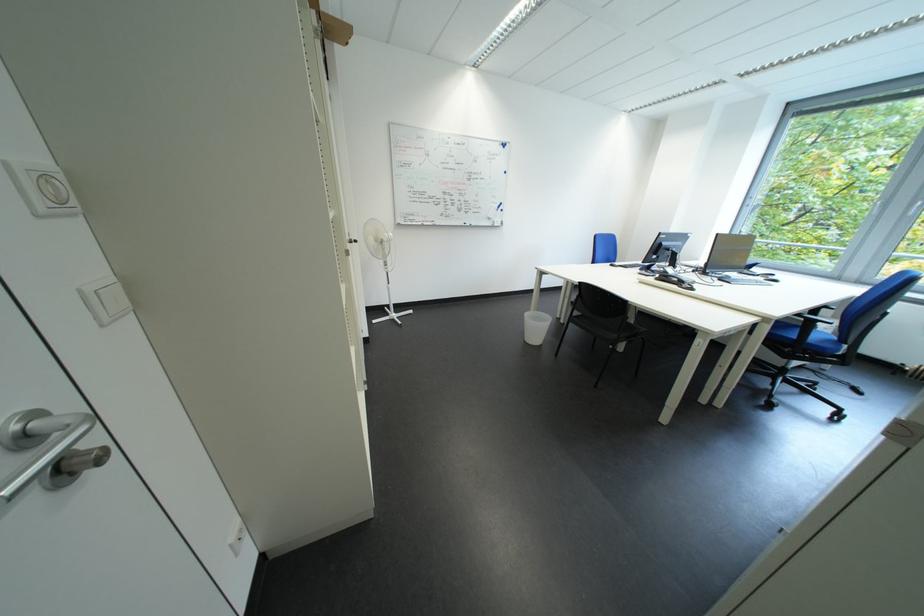
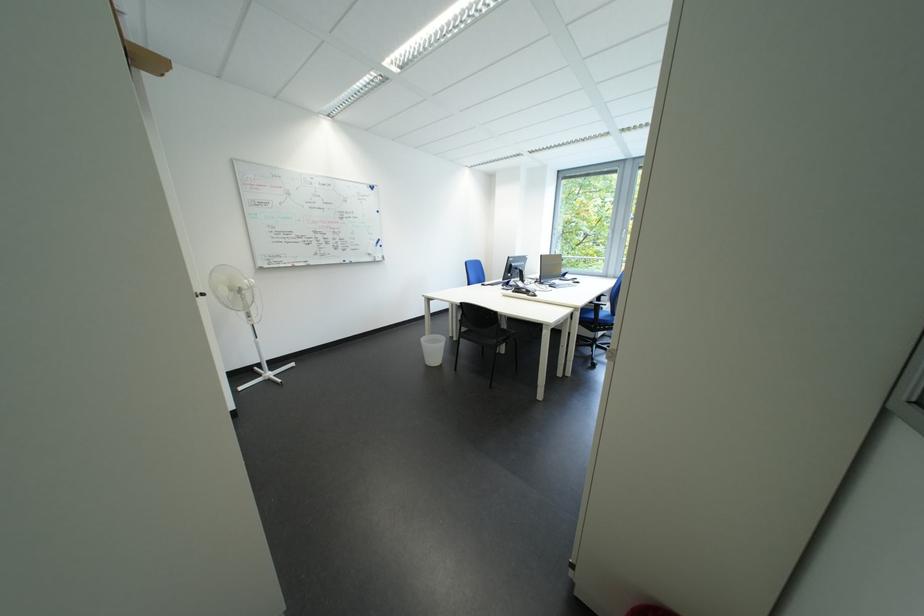
Question: The camera is either moving clockwise (left) or counter-clockwise (right) around the object. The first image is from the beginning of the video and the second image is from the end. Is the camera moving left or right when shooting the video?

Choices:
 (A) Left
 (B) Right

Answer: (A)